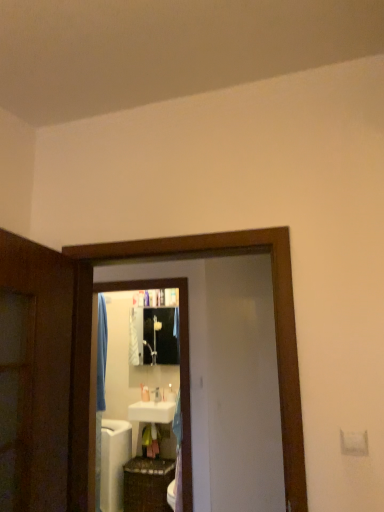
Where is `black glossy mirror at center`? The image size is (384, 512). black glossy mirror at center is located at coordinates (180, 362).

At what (x,y) coordinates should I click in order to perform the action: click on white glossy bath at lower left. Please return your answer as a coordinate pair (x, y). The width and height of the screenshot is (384, 512). Looking at the image, I should click on (114, 462).

Locate an element on the screen. The height and width of the screenshot is (512, 384). woven brown basket at lower center is located at coordinates (147, 484).

Where is `white glossy soap dispenser at center, the second toiletry positioned from the front`? The width and height of the screenshot is (384, 512). white glossy soap dispenser at center, the second toiletry positioned from the front is located at coordinates (145, 394).

The width and height of the screenshot is (384, 512). In order to click on the 2nd screen door in front of the black glossy medicine cabinet at center, starting your count from the anchor in this screenshot , I will do `click(275, 322)`.

Which object is positioned more to the right, black glossy medicine cabinet at center or white glossy screen door at center, positioned as the 2th screen door in back-to-front order?

Positioned to the right is white glossy screen door at center, positioned as the 2th screen door in back-to-front order.

Is black glossy medicine cabinet at center wider than white glossy screen door at center, which is counted as the first screen door, starting from the front?

No, black glossy medicine cabinet at center is not wider than white glossy screen door at center, which is counted as the first screen door, starting from the front.

Looking at this image, measure the distance from black glossy medicine cabinet at center to white glossy screen door at center, which is counted as the first screen door, starting from the front.

black glossy medicine cabinet at center and white glossy screen door at center, which is counted as the first screen door, starting from the front, are 2.94 meters apart from each other.

From the image's perspective, between white matte screen door at center, placed as the 2th screen door when sorted from front to back, and woven brown basket at lower center, which one is located above?

From the image's view, white matte screen door at center, placed as the 2th screen door when sorted from front to back, is above.

Measure the distance from white matte screen door at center, placed as the 2th screen door when sorted from front to back, to woven brown basket at lower center.

white matte screen door at center, placed as the 2th screen door when sorted from front to back, and woven brown basket at lower center are 5.28 feet apart from each other.

Which is behind, point (212, 460) or point (137, 495)?

The point (137, 495) is farther.

Looking at this image, considering the relative sizes of white matte screen door at center, which appears as the 1th screen door when viewed from the back, and woven brown basket at lower center in the image provided, is white matte screen door at center, which appears as the 1th screen door when viewed from the back, bigger than woven brown basket at lower center?

No.

Considering the positions of point (170, 396) and point (164, 240), is point (170, 396) closer or farther from the camera than point (164, 240)?

Point (170, 396) is farther from the camera than point (164, 240).

Where is `the 2nd screen door directly above the white glossy sink at center, which is counted as the second toiletry, starting from the left (from a real-world perspective)`? This screenshot has height=512, width=384. the 2nd screen door directly above the white glossy sink at center, which is counted as the second toiletry, starting from the left (from a real-world perspective) is located at coordinates (275, 322).

From the picture: Are black glossy medicine cabinet at center and black glossy mirror at center far apart?

black glossy medicine cabinet at center is far away from black glossy mirror at center.

Is black glossy medicine cabinet at center facing towards black glossy mirror at center?

Yes, black glossy medicine cabinet at center faces towards black glossy mirror at center.

Where is `medicine cabinet above the black glossy mirror at center (from the image's perspective)`? The image size is (384, 512). medicine cabinet above the black glossy mirror at center (from the image's perspective) is located at coordinates click(x=156, y=335).

Does black glossy medicine cabinet at center have a greater width compared to black glossy mirror at center?

In fact, black glossy medicine cabinet at center might be narrower than black glossy mirror at center.

Is black glossy medicine cabinet at center not near white glossy bath at lower left?

Yes, black glossy medicine cabinet at center and white glossy bath at lower left are located far from each other.

Based on the photo, is black glossy medicine cabinet at center taller or shorter than white glossy bath at lower left?

Clearly, black glossy medicine cabinet at center is shorter compared to white glossy bath at lower left.

How different are the orientations of black glossy medicine cabinet at center and white glossy bath at lower left in degrees?

black glossy medicine cabinet at center and white glossy bath at lower left are facing 1.86 degrees away from each other.

In the scene shown: Is black glossy medicine cabinet at center inside the boundaries of white glossy bath at lower left, or outside?

black glossy medicine cabinet at center is not inside white glossy bath at lower left, it's outside.

From a real-world perspective, is black glossy mirror at center over black glossy medicine cabinet at center?

Actually, black glossy mirror at center is physically below black glossy medicine cabinet at center in the real world.

Measure the distance between black glossy mirror at center and black glossy medicine cabinet at center.

black glossy mirror at center is 1.64 meters from black glossy medicine cabinet at center.

Could you tell me if black glossy mirror at center is turned towards black glossy medicine cabinet at center?

No, black glossy mirror at center is not oriented towards black glossy medicine cabinet at center.

From the image's perspective, is black glossy mirror at center positioned above or below black glossy medicine cabinet at center?

From the image's perspective, black glossy mirror at center appears below black glossy medicine cabinet at center.

In the scene shown: Which object is thinner, white glossy sink at center or white glossy screen door at center, which is counted as the first screen door, starting from the front?

With smaller width is white glossy screen door at center, which is counted as the first screen door, starting from the front.

From a real-world perspective, who is located higher, white glossy sink at center or white glossy screen door at center, which is counted as the first screen door, starting from the front?

white glossy screen door at center, which is counted as the first screen door, starting from the front, from a real-world perspective.

Which is in front, point (170, 407) or point (295, 403)?

The point (295, 403) is more forward.

From the image's perspective, is white glossy sink at center positioned above or below white glossy screen door at center, positioned as the 2th screen door in back-to-front order?

Based on their image positions, white glossy sink at center is located beneath white glossy screen door at center, positioned as the 2th screen door in back-to-front order.

From a real-world perspective, count 1st screen doors downward from the black glossy medicine cabinet at center and point to it. Please provide its 2D coordinates.

[(275, 322)]

This screenshot has width=384, height=512. Identify the location of the 1st screen door in front of the woven brown basket at lower center, starting your count from the anchor. (243, 387).

Based on their spatial positions, is white matte screen door at center, which appears as the 1th screen door when viewed from the back, or white glossy sink at center, acting as the 2th toiletry starting from the back, closer to white glossy screen door at center, positioned as the 2th screen door in back-to-front order?

white matte screen door at center, which appears as the 1th screen door when viewed from the back, is positioned closer to the anchor white glossy screen door at center, positioned as the 2th screen door in back-to-front order.

From the image, which object appears to be farther from white glossy sink at center, which appears as the 1th toiletry when viewed from the front, black glossy medicine cabinet at center or black glossy mirror at center?

The object further to white glossy sink at center, which appears as the 1th toiletry when viewed from the front, is black glossy mirror at center.

When comparing their distances from white glossy screen door at center, positioned as the 2th screen door in back-to-front order, does black glossy medicine cabinet at center or white glossy sink at center, which appears as the 1th toiletry when viewed from the front, seem further?

white glossy sink at center, which appears as the 1th toiletry when viewed from the front.

Estimate the real-world distances between objects in this image. Which object is closer to black glossy medicine cabinet at center, white glossy screen door at center, positioned as the 2th screen door in back-to-front order, or white glossy sink at center?

The object closer to black glossy medicine cabinet at center is white glossy sink at center.

Looking at the image, which one is located further to black glossy medicine cabinet at center, black glossy mirror at center or white matte screen door at center, placed as the 2th screen door when sorted from front to back?

white matte screen door at center, placed as the 2th screen door when sorted from front to back, is positioned further to the anchor black glossy medicine cabinet at center.

Looking at the image, which one is located closer to white glossy bath at lower left, black glossy mirror at center or white glossy soap dispenser at center, the 1th toiletry positioned from the back?

The object closer to white glossy bath at lower left is white glossy soap dispenser at center, the 1th toiletry positioned from the back.

Based on their spatial positions, is white matte screen door at center, placed as the 2th screen door when sorted from front to back, or black glossy medicine cabinet at center closer to white glossy sink at center, acting as the 2th toiletry starting from the back?

black glossy medicine cabinet at center.

Estimate the real-world distances between objects in this image. Which object is further from white glossy bath at lower left, black glossy mirror at center or woven brown basket at lower center?

black glossy mirror at center is positioned further to the anchor white glossy bath at lower left.

Where is `bath between white glossy soap dispenser at center, the 1th toiletry positioned from the back, and woven brown basket at lower center, in the vertical direction`? bath between white glossy soap dispenser at center, the 1th toiletry positioned from the back, and woven brown basket at lower center, in the vertical direction is located at coordinates (114, 462).

Locate an element on the screen. The height and width of the screenshot is (512, 384). toiletry positioned between black glossy mirror at center and white glossy soap dispenser at center, the second toiletry positioned from the front, from near to far is located at coordinates (171, 393).

Where is `mirror positioned between white glossy screen door at center, which is counted as the first screen door, starting from the front, and white glossy sink at center from near to far`? This screenshot has height=512, width=384. mirror positioned between white glossy screen door at center, which is counted as the first screen door, starting from the front, and white glossy sink at center from near to far is located at coordinates (180, 362).

The image size is (384, 512). I want to click on screen door located between white glossy screen door at center, positioned as the 2th screen door in back-to-front order, and white glossy soap dispenser at center, the 1th toiletry positioned from the back, in the depth direction, so click(243, 387).